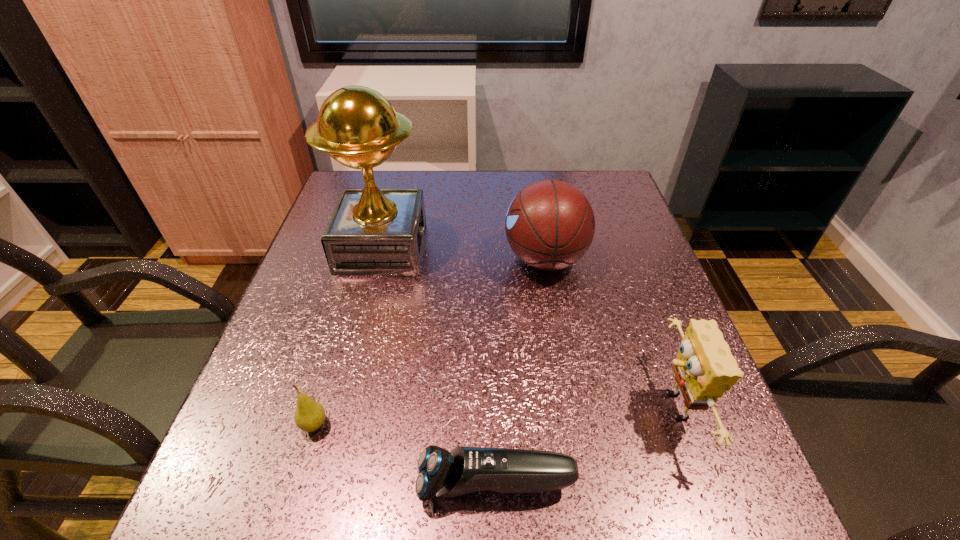
The width and height of the screenshot is (960, 540). I want to click on free point that satisfies the following two spatial constraints: 1. on the front-facing side of the basketball; 2. on the right side of the tallest object, so click(379, 259).